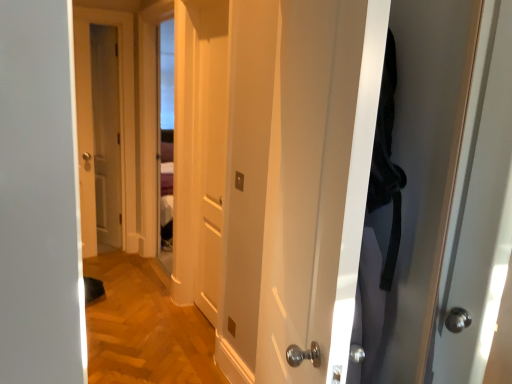
What do you see at coordinates (92, 124) in the screenshot? This screenshot has width=512, height=384. I see `matte wooden door at left, which is the 1th door in left-to-right order` at bounding box center [92, 124].

Find the location of a particular element. The image size is (512, 384). white matte door at center, placed as the second door when sorted from left to right is located at coordinates point(210,143).

Can you tell me how much white matte door at center, acting as the second door starting from the right, and white glossy door at center, which is counted as the third door, starting from the back, differ in facing direction?

white matte door at center, acting as the second door starting from the right, and white glossy door at center, which is counted as the third door, starting from the back, are facing 23.8 degrees away from each other.

In terms of size, does white matte door at center, placed as the 2th door when sorted from back to front, appear bigger or smaller than white glossy door at center, which is the 1th door in right-to-left order?

In the image, white matte door at center, placed as the 2th door when sorted from back to front, appears to be smaller than white glossy door at center, which is the 1th door in right-to-left order.

Which of these two, white matte door at center, acting as the second door starting from the right, or white glossy door at center, positioned as the 3th door in left-to-right order, is thinner?

white matte door at center, acting as the second door starting from the right.

Which is in front, white matte door at center, placed as the second door when sorted from left to right, or white glossy door at center, which is counted as the third door, starting from the back?

white glossy door at center, which is counted as the third door, starting from the back, is closer to the camera.

From a real-world perspective, is white glossy door at center, the first door when ordered from front to back, located beneath matte wooden door at left, which is the 1th door in left-to-right order?

Actually, white glossy door at center, the first door when ordered from front to back, is physically above matte wooden door at left, which is the 1th door in left-to-right order, in the real world.

Is white glossy door at center, positioned as the 3th door in left-to-right order, not close to matte wooden door at left, the first door positioned from the back?

Yes, white glossy door at center, positioned as the 3th door in left-to-right order, is far from matte wooden door at left, the first door positioned from the back.

Does point (300, 269) appear closer or farther from the camera than point (87, 17)?

Point (300, 269) appears to be closer to the viewer than point (87, 17).

Is white glossy door at center, which is the 1th door in right-to-left order, outside of matte wooden door at left, which is the 1th door in left-to-right order?

Yes, white glossy door at center, which is the 1th door in right-to-left order, is outside of matte wooden door at left, which is the 1th door in left-to-right order.

Is matte wooden door at left, the first door positioned from the back, smaller than white glossy door at center, the first door when ordered from front to back?

Yes.

Is matte wooden door at left, the first door positioned from the back, further to the viewer compared to white glossy door at center, which is counted as the third door, starting from the back?

Yes, matte wooden door at left, the first door positioned from the back, is further from the viewer.

How different are the orientations of matte wooden door at left, marked as the 3th door in a right-to-left arrangement, and white glossy door at center, which is the 1th door in right-to-left order, in degrees?

The angle between the facing direction of matte wooden door at left, marked as the 3th door in a right-to-left arrangement, and the facing direction of white glossy door at center, which is the 1th door in right-to-left order, is 116 degrees.

Can you confirm if matte wooden door at left, which is the 1th door in left-to-right order, is positioned to the left of white glossy door at center, positioned as the 3th door in left-to-right order?

Yes.

From the image's perspective, is matte wooden door at left, marked as the 3th door in a right-to-left arrangement, beneath white matte door at center, the second door in the front-to-back sequence?

No.

Is matte wooden door at left, which is the 1th door in left-to-right order, turned away from white matte door at center, the second door in the front-to-back sequence?

That's not correct — matte wooden door at left, which is the 1th door in left-to-right order, is not looking away from white matte door at center, the second door in the front-to-back sequence.

Where is `door on the left side of white matte door at center, placed as the 2th door when sorted from back to front`? The image size is (512, 384). door on the left side of white matte door at center, placed as the 2th door when sorted from back to front is located at coordinates (92, 124).

Is matte wooden door at left, the first door positioned from the back, shorter than white matte door at center, placed as the 2th door when sorted from back to front?

In fact, matte wooden door at left, the first door positioned from the back, may be taller than white matte door at center, placed as the 2th door when sorted from back to front.

Between white matte door at center, placed as the second door when sorted from left to right, and matte wooden door at left, which is the 1th door in left-to-right order, which one has smaller width?

Thinner between the two is white matte door at center, placed as the second door when sorted from left to right.

From a real-world perspective, is white matte door at center, placed as the second door when sorted from left to right, over matte wooden door at left, the third door in the front-to-back sequence?

No, from a real-world perspective, white matte door at center, placed as the second door when sorted from left to right, is not over matte wooden door at left, the third door in the front-to-back sequence

Is white matte door at center, placed as the second door when sorted from left to right, oriented towards matte wooden door at left, the first door positioned from the back?

No, white matte door at center, placed as the second door when sorted from left to right, does not turn towards matte wooden door at left, the first door positioned from the back.

From their relative heights in the image, would you say white matte door at center, placed as the second door when sorted from left to right, is taller or shorter than matte wooden door at left, marked as the 3th door in a right-to-left arrangement?

Clearly, white matte door at center, placed as the second door when sorted from left to right, is shorter compared to matte wooden door at left, marked as the 3th door in a right-to-left arrangement.

Does white glossy door at center, positioned as the 3th door in left-to-right order, have a smaller size compared to white matte door at center, placed as the 2th door when sorted from back to front?

No.

You are a GUI agent. You are given a task and a screenshot of the screen. Output one action in this format:
    pyautogui.click(x=<x>, y=<y>)
    Task: Click on the 1st door to the left when counting from the white glossy door at center, positioned as the 3th door in left-to-right order
    The image size is (512, 384).
    Given the screenshot: What is the action you would take?
    pyautogui.click(x=210, y=143)

Does white glossy door at center, which is counted as the third door, starting from the back, have a greater width compared to white matte door at center, placed as the 2th door when sorted from back to front?

Yes, white glossy door at center, which is counted as the third door, starting from the back, is wider than white matte door at center, placed as the 2th door when sorted from back to front.

The width and height of the screenshot is (512, 384). In order to click on door that is the 1st one when counting backward from the white glossy door at center, positioned as the 3th door in left-to-right order in this screenshot , I will do `click(210, 143)`.

Image resolution: width=512 pixels, height=384 pixels. What are the coordinates of `door that is the 2nd one when counting leftward from the white glossy door at center, which is counted as the third door, starting from the back` in the screenshot? It's located at (92, 124).

Looking at the image, which one is located closer to white matte door at center, placed as the second door when sorted from left to right, white glossy door at center, positioned as the 3th door in left-to-right order, or matte wooden door at left, marked as the 3th door in a right-to-left arrangement?

A: Based on the image, white glossy door at center, positioned as the 3th door in left-to-right order, appears to be nearer to white matte door at center, placed as the second door when sorted from left to right.

When comparing their distances from matte wooden door at left, marked as the 3th door in a right-to-left arrangement, does white glossy door at center, positioned as the 3th door in left-to-right order, or white matte door at center, placed as the 2th door when sorted from back to front, seem further?

Among the two, white glossy door at center, positioned as the 3th door in left-to-right order, is located further to matte wooden door at left, marked as the 3th door in a right-to-left arrangement.

Estimate the real-world distances between objects in this image. Which object is closer to matte wooden door at left, the third door in the front-to-back sequence, white matte door at center, placed as the second door when sorted from left to right, or white glossy door at center, which is the 1th door in right-to-left order?

white matte door at center, placed as the second door when sorted from left to right.

From the image, which object appears to be farther from white glossy door at center, the first door when ordered from front to back, white matte door at center, placed as the second door when sorted from left to right, or matte wooden door at left, the first door positioned from the back?

matte wooden door at left, the first door positioned from the back, is further to white glossy door at center, the first door when ordered from front to back.

Which object lies further to the anchor point white glossy door at center, positioned as the 3th door in left-to-right order, matte wooden door at left, the first door positioned from the back, or white matte door at center, placed as the second door when sorted from left to right?

matte wooden door at left, the first door positioned from the back, is further to white glossy door at center, positioned as the 3th door in left-to-right order.

From the image, which object appears to be farther from white matte door at center, placed as the 2th door when sorted from back to front, matte wooden door at left, which is the 1th door in left-to-right order, or white glossy door at center, which is counted as the third door, starting from the back?

Among the two, matte wooden door at left, which is the 1th door in left-to-right order, is located further to white matte door at center, placed as the 2th door when sorted from back to front.

Where is `door between white glossy door at center, the first door when ordered from front to back, and matte wooden door at left, which is the 1th door in left-to-right order, in the front-back direction`? The height and width of the screenshot is (384, 512). door between white glossy door at center, the first door when ordered from front to back, and matte wooden door at left, which is the 1th door in left-to-right order, in the front-back direction is located at coordinates (210, 143).